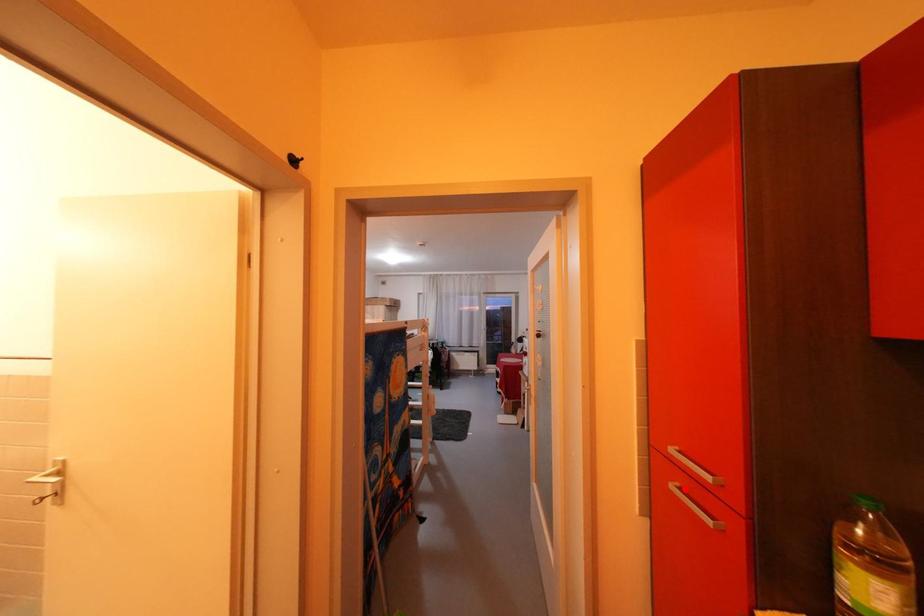
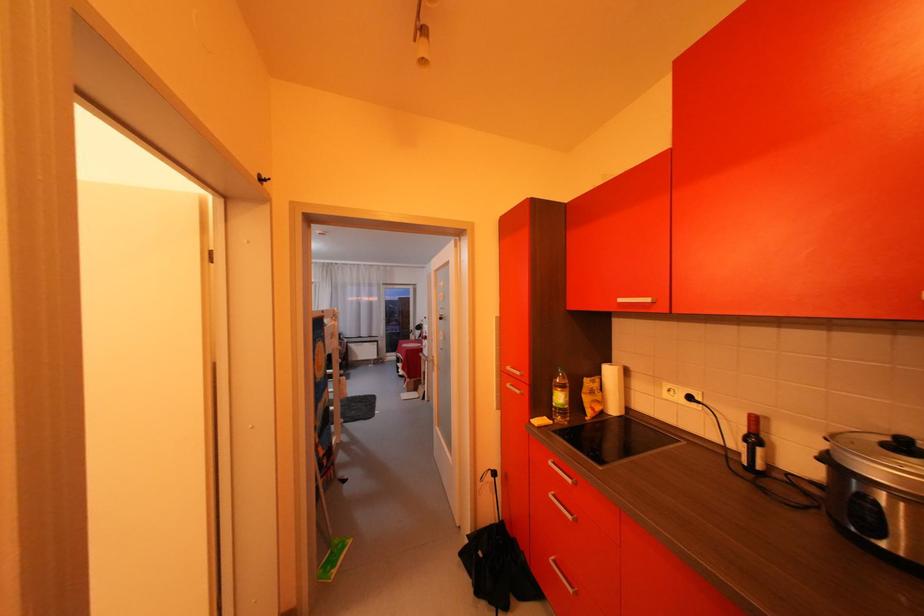
In the second image, find the point that corresponds to the highlighted location in the first image.

(518, 387)